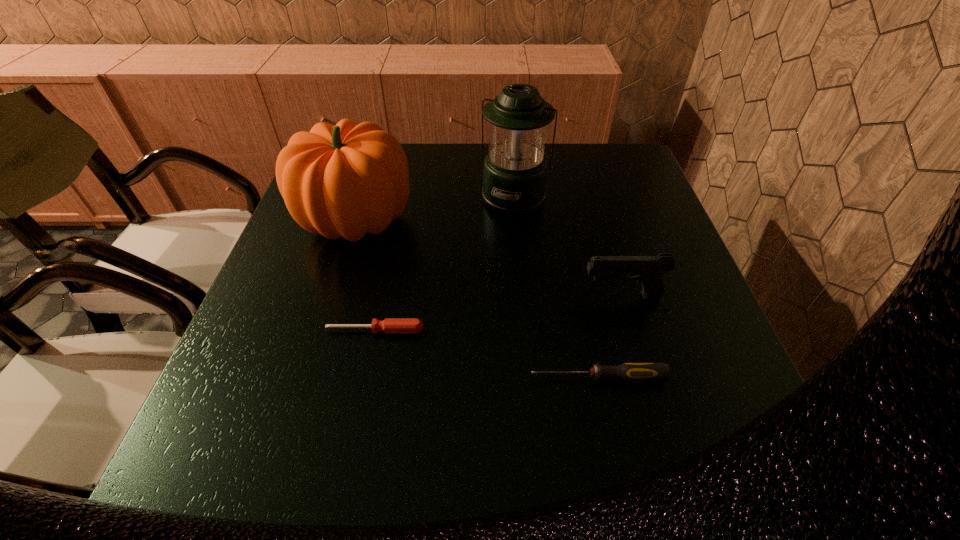
The image size is (960, 540). Identify the location of vacant space located at the barrel of the third shortest object. (553, 295).

Locate an element on the screen. Image resolution: width=960 pixels, height=540 pixels. free location located 0.380m at the barrel of the third shortest object is located at coordinates (401, 295).

Find the location of a particular element. The height and width of the screenshot is (540, 960). free region located 0.390m at the barrel of the third shortest object is located at coordinates (396, 295).

You are a GUI agent. You are given a task and a screenshot of the screen. Output one action in this format:
    pyautogui.click(x=<x>, y=<y>)
    Task: Click on the free spot located 0.350m insert the taller screwdriver into a screw head
    The width and height of the screenshot is (960, 540).
    Given the screenshot: What is the action you would take?
    pyautogui.click(x=336, y=377)

You are a GUI agent. You are given a task and a screenshot of the screen. Output one action in this format:
    pyautogui.click(x=<x>, y=<y>)
    Task: Click on the free space located 0.070m insert the taller screwdriver into a screw head
    
    Given the screenshot: What is the action you would take?
    pyautogui.click(x=492, y=377)

Identify the location of vacant space situated insert the taller screwdriver into a screw head. The height and width of the screenshot is (540, 960). (481, 377).

Find the location of `blank area located on the right of the farther screwdriver`. blank area located on the right of the farther screwdriver is located at coordinates pos(531,330).

Locate an element on the screen. This screenshot has height=540, width=960. lantern that is at the far edge is located at coordinates (514, 178).

At what (x,y) coordinates should I click in order to perform the action: click on pumpkin that is at the far edge. Please return your answer as a coordinate pair (x, y). The image size is (960, 540). Looking at the image, I should click on (347, 180).

Locate an element on the screen. The image size is (960, 540). pumpkin that is at the left edge is located at coordinates (347, 180).